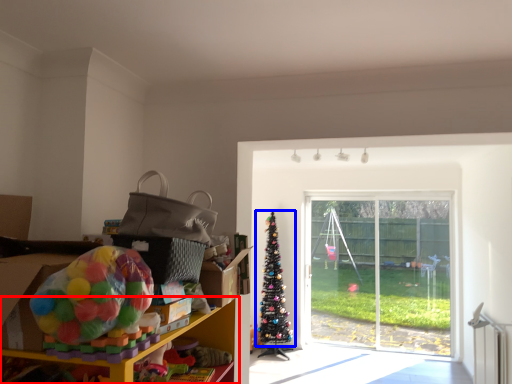
Question: Which object appears farthest to the camera in this image, shelf (highlighted by a red box) or christmas tree (highlighted by a blue box)?

Choices:
 (A) shelf
 (B) christmas tree

Answer: (B)